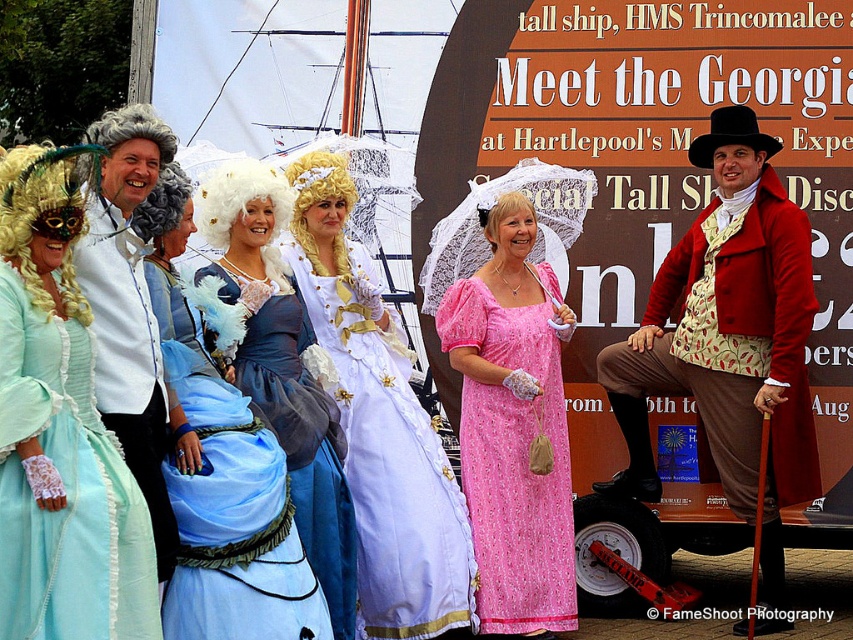
You are a photographer at the event and want to take a group photo of the pink satin dress at center and the golden feathered wig at left. Since you want to ensure both are clearly visible, which object should you focus on first to avoid blurriness?

The pink satin dress at center is larger in size than the golden feathered wig at left, so focusing on the pink satin dress at center first would ensure it is in focus, and the smaller golden feathered wig at left would likely remain sharp due to depth of field.

You are a photographer at the event and want to capture both the pink satin dress at center and the blue satin dress at center in a single shot. Which dress should you position closer to the left side of your camera frame to include both?

To include both the pink satin dress at center and the blue satin dress at center in a single shot, position the blue satin dress at center closer to the left side of your camera frame since the pink satin dress at center is to the right of the blue satin dress at center.